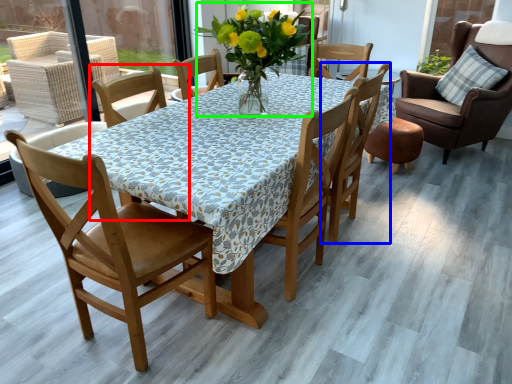
Question: Estimate the real-world distances between objects in this image. Which object is farther from chair (highlighted by a red box), chair (highlighted by a blue box) or floral arrangement (highlighted by a green box)?

Choices:
 (A) chair
 (B) floral arrangement

Answer: (A)